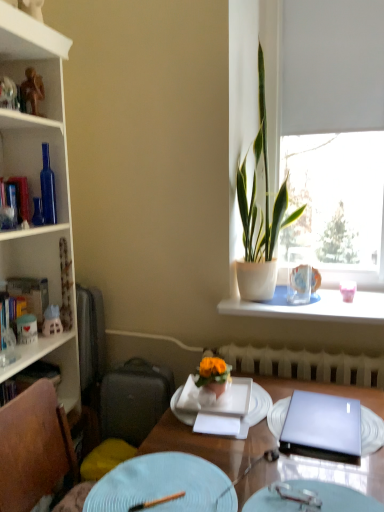
At what (x,y) coordinates should I click in order to perform the action: click on vacant area that lies between wooden chopstick at lower center, the 3th tableware viewed from the top, and metallic silver fork at center, marked as the 2th tableware in a top-to-bottom arrangement. Please return your answer as a coordinate pair (x, y). Looking at the image, I should click on (230, 501).